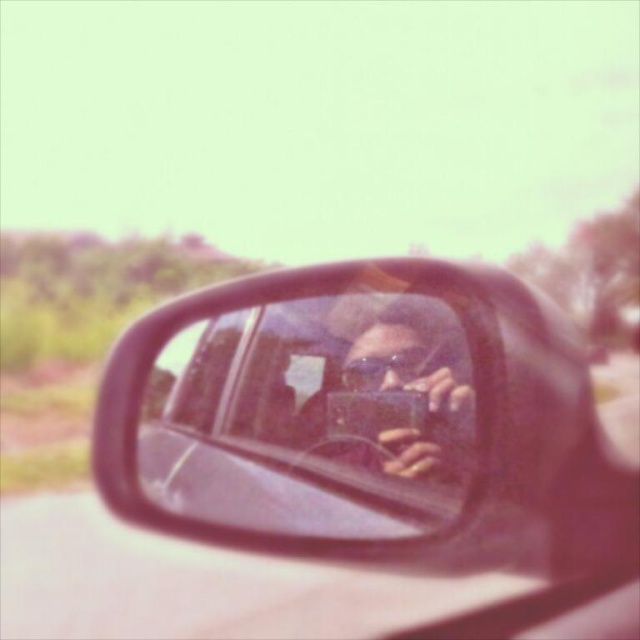
You are inside a car and looking at the side mirror. There are two points marked in the mirror at coordinates point [268,420] and point [364,298]. Which point is closer to you?

Point [268,420] is further to the viewer than point [364,298], so the point closer to you is point [364,298].

You are standing 2 meters away from the car. Can you reach the point at coordinates point (420, 397) on the car mirror without moving closer than 1.5 meters?

The point at coordinates point (420, 397) is 1.57 meters from the viewer. Since you are standing 2 meters away and cannot move closer than 1.5 meters, the distance of 1.57 meters is just beyond your minimum allowed distance. Therefore, you cannot reach the point without moving closer than 1.5 meters.

You are standing in front of a car and want to take a selfie using the shiny black mirror at center. If your arm can extend 5 feet, can you reach the mirror to adjust it for a better angle?

The shiny black mirror at center is 4.74 feet away from the viewer. Since your arm can extend 5 feet, which is longer than the distance to the mirror, you can reach it to adjust it for a better angle.